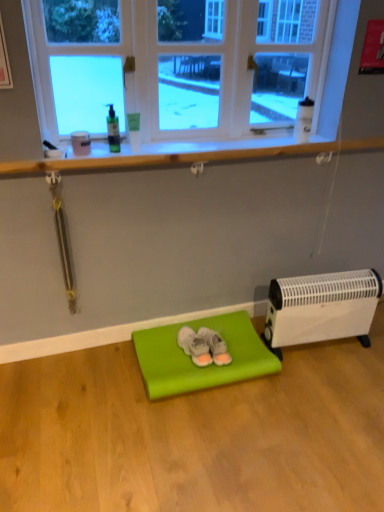
Locate an element on the screen. vacant area on top of matte green yoga mat at center (from a real-world perspective) is located at coordinates tap(213, 337).